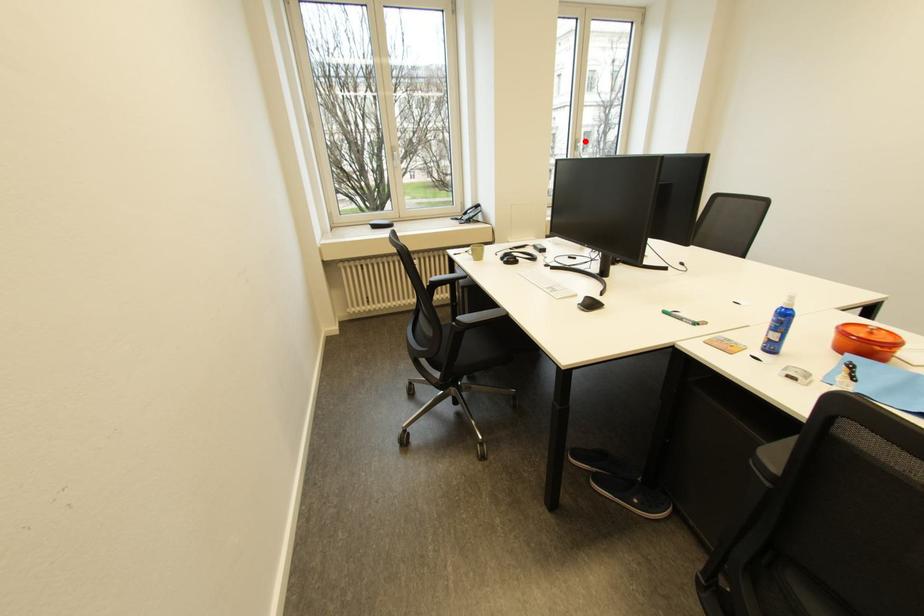
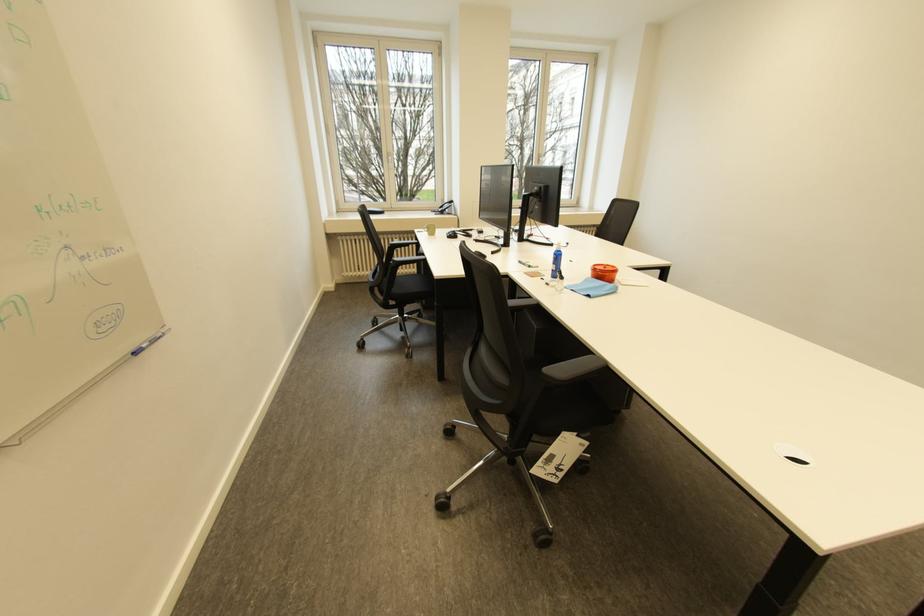
The point at the highlighted location is marked in the first image. Where is the corresponding point in the second image?

(548, 156)